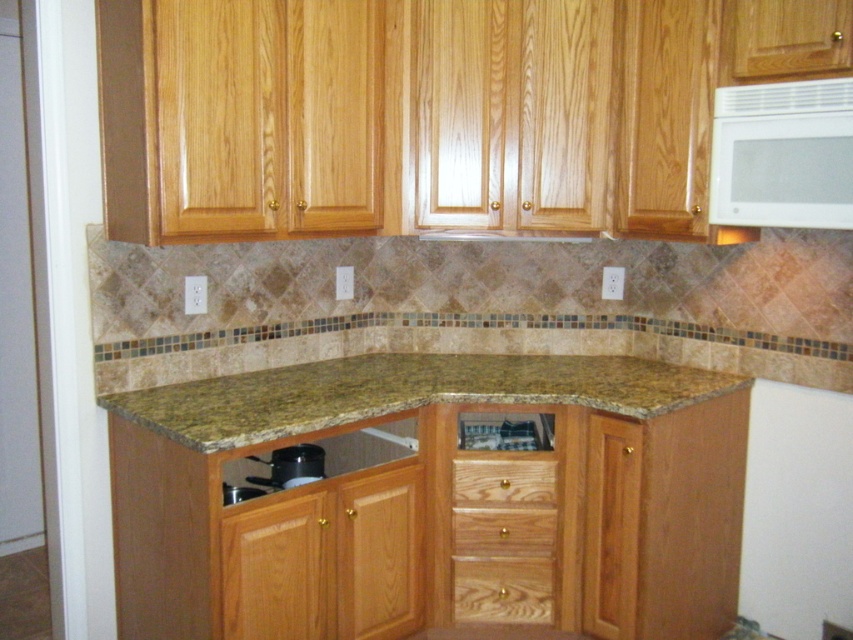
Question: Which point appears farthest from the camera in this image?

Choices:
 (A) (283, 486)
 (B) (460, 611)
 (C) (491, 492)
 (D) (334, 371)

Answer: (D)

Question: Which object appears farthest from the camera in this image?

Choices:
 (A) wooden at lower center
 (B) wooden drawer at lower center
 (C) light brown wood drawer at lower center

Answer: (A)

Question: Based on their relative distances, which object is nearer to the wooden drawer at lower center?

Choices:
 (A) light brown wood drawer at lower center
 (B) black matte pot at lower center
 (C) white glossy microwave at upper right
 (D) yellow-green granite countertop at center

Answer: (A)

Question: Can you confirm if white glossy microwave at upper right is positioned to the left of black matte pot at lower center?

Choices:
 (A) no
 (B) yes

Answer: (A)

Question: Does white glossy microwave at upper right have a lesser width compared to light brown wood drawer at lower center?

Choices:
 (A) yes
 (B) no

Answer: (A)

Question: Does wooden at lower center have a smaller size compared to wooden drawer at lower center?

Choices:
 (A) no
 (B) yes

Answer: (A)